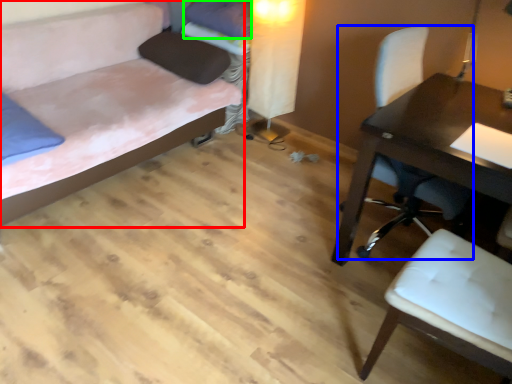
Question: Based on their relative distances, which object is farther from bed (highlighted by a red box)? Choose from chair (highlighted by a blue box) and pillow (highlighted by a green box).

Choices:
 (A) chair
 (B) pillow

Answer: (A)